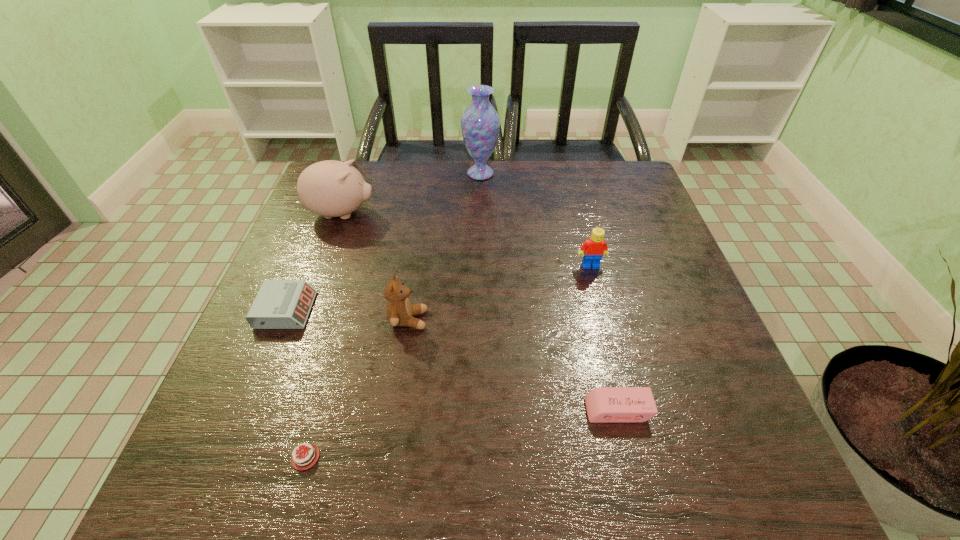
This screenshot has width=960, height=540. I want to click on vacant area that lies between the fourth object from right to left and the Lego, so click(x=499, y=293).

You are a GUI agent. You are given a task and a screenshot of the screen. Output one action in this format:
    pyautogui.click(x=<x>, y=<y>)
    Task: Click on the free space between the second nearest object and the third farthest object
    The width and height of the screenshot is (960, 540).
    Given the screenshot: What is the action you would take?
    pyautogui.click(x=604, y=338)

Image resolution: width=960 pixels, height=540 pixels. In order to click on vacant area between the third object from right to left and the Lego in this screenshot , I will do `click(536, 220)`.

At what (x,y) coordinates should I click in order to perform the action: click on free spot between the eraser and the Lego. Please return your answer as a coordinate pair (x, y). Looking at the image, I should click on (604, 338).

What are the coordinates of `free area in between the third object from right to left and the second nearest object` in the screenshot? It's located at (549, 292).

This screenshot has width=960, height=540. In order to click on blank region between the alarm clock and the chocolate cake in this screenshot , I will do `click(296, 383)`.

Locate an element on the screen. unoccupied position between the vase and the eraser is located at coordinates (549, 292).

At what (x,y) coordinates should I click in order to perform the action: click on vacant point located between the second nearest object and the alarm clock. Please return your answer as a coordinate pair (x, y). The image size is (960, 540). Looking at the image, I should click on (452, 360).

This screenshot has width=960, height=540. I want to click on free space that is in between the tallest object and the second nearest object, so click(x=549, y=292).

Find the location of `empty space between the alarm clock and the teddy bear`. empty space between the alarm clock and the teddy bear is located at coordinates (348, 315).